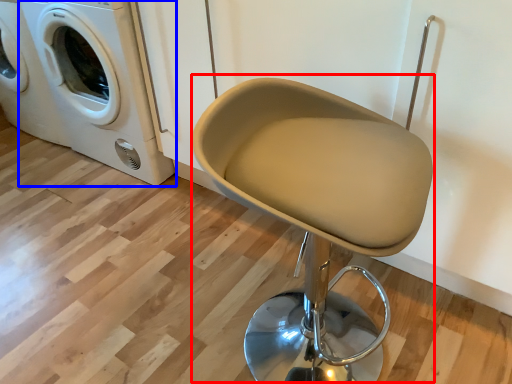
Question: Which object is closer to the camera taking this photo, swivel chair (highlighted by a red box) or washing machine (highlighted by a blue box)?

Choices:
 (A) swivel chair
 (B) washing machine

Answer: (A)